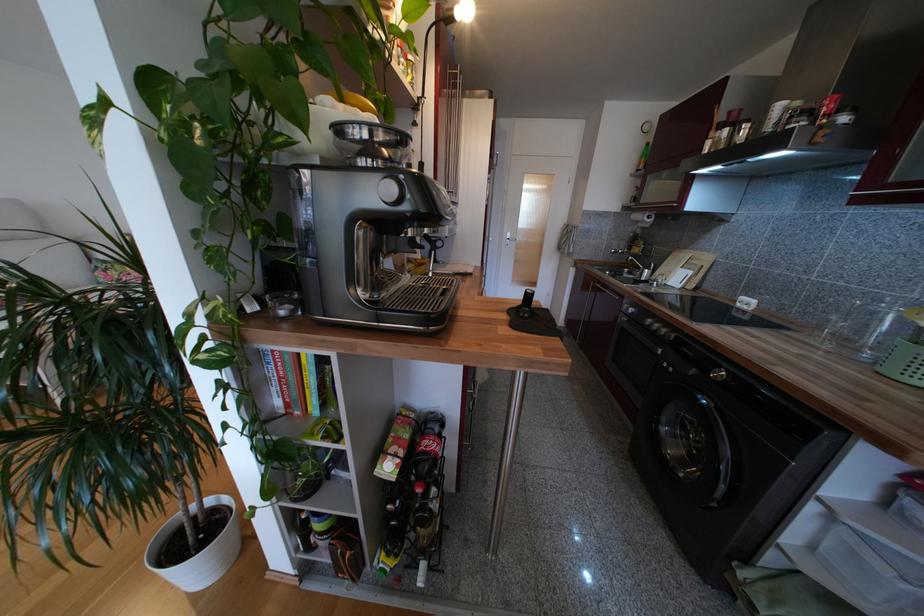
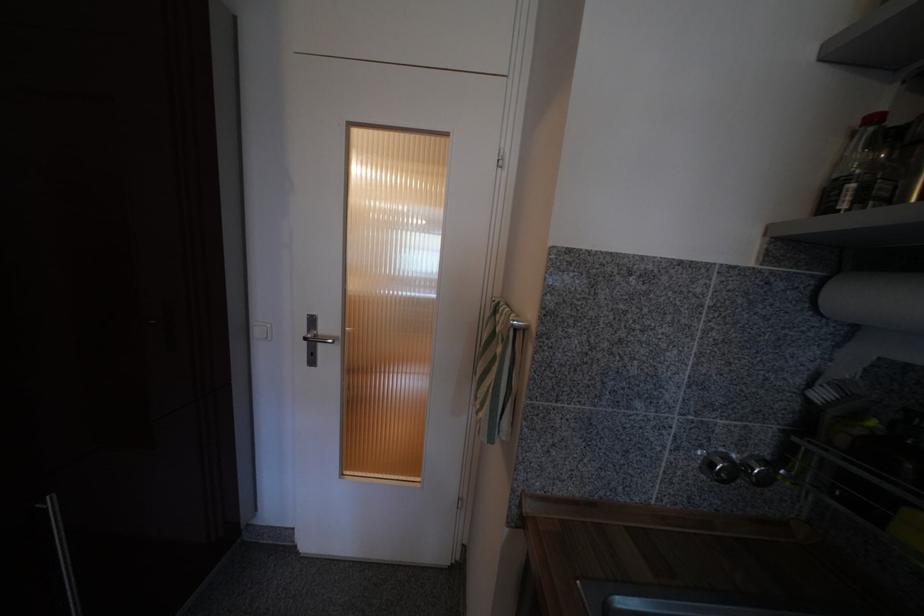
Where in the second image is the point corresponding to the point at 626,254 from the first image?

(772, 482)